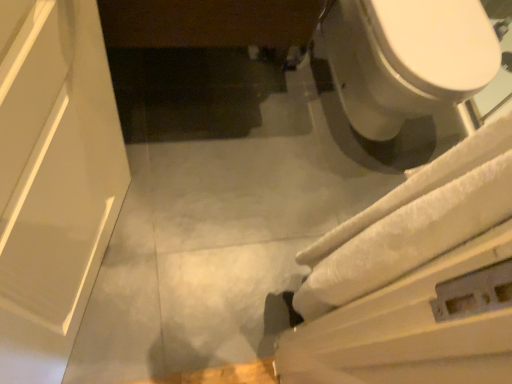
Identify the location of vacant area that is in front of white glossy toilet at upper right. (295, 166).